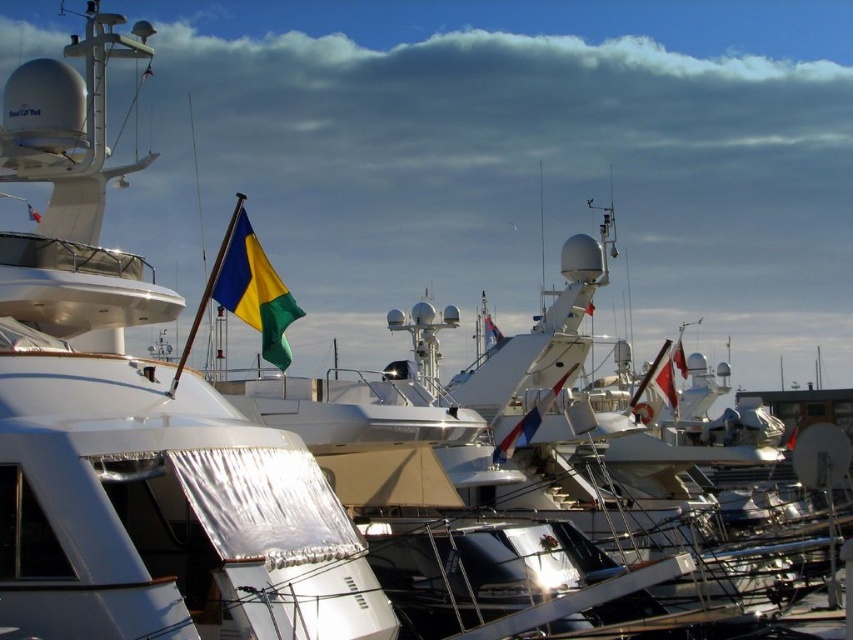
Question: Is white glossy boat at upper left to the left of blue fabric flag at center from the viewer's perspective?

Choices:
 (A) yes
 (B) no

Answer: (A)

Question: Which point is closer to the camera taking this photo?

Choices:
 (A) (682, 360)
 (B) (268, 360)
 (C) (488, 317)

Answer: (B)

Question: Which object appears farthest from the camera in this image?

Choices:
 (A) blue fabric flag at center
 (B) white glossy boat at upper left
 (C) white fabric flag at upper center

Answer: (C)

Question: Can you confirm if white glossy boat at upper left is positioned to the left of yellow-green fabric flag at center?

Choices:
 (A) no
 (B) yes

Answer: (B)

Question: Which point is farther from the camera taking this photo?

Choices:
 (A) (669, 358)
 (B) (38, 138)
 (C) (225, 268)
 (D) (682, 356)

Answer: (D)

Question: Observing the image, what is the correct spatial positioning of black fabric flag at upper right in reference to white fabric flag at upper center?

Choices:
 (A) right
 (B) left

Answer: (B)